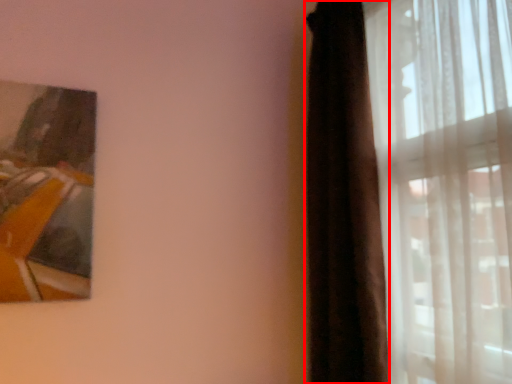
Question: From the image's perspective, what is the correct spatial positioning of curtain (annotated by the red box) in reference to curtain?

Choices:
 (A) above
 (B) below

Answer: (B)